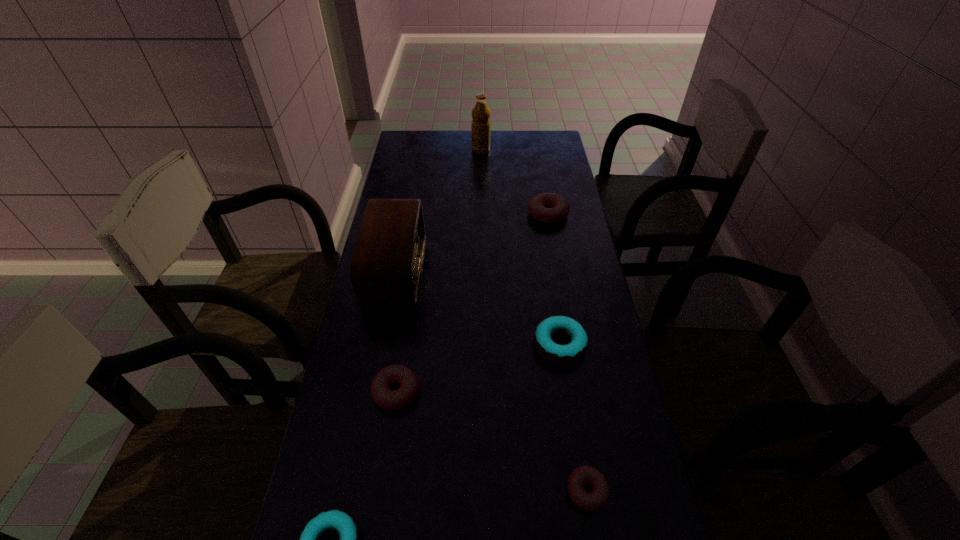
What are the coordinates of `the shortest object` in the screenshot? It's located at point(582,475).

You are a GUI agent. You are given a task and a screenshot of the screen. Output one action in this format:
    pyautogui.click(x=<x>, y=<y>)
    Task: Click on the nearest pink doughnut
    The height and width of the screenshot is (540, 960).
    Given the screenshot: What is the action you would take?
    [582, 475]

The image size is (960, 540). I want to click on free space located 0.280m on the front label of the farthest object, so click(x=408, y=150).

Image resolution: width=960 pixels, height=540 pixels. Identify the location of vacant space located 0.140m on the front label of the farthest object. (440, 150).

The image size is (960, 540). Identify the location of free space located 0.060m on the front label of the farthest object. (458, 150).

Where is `free space located 0.110m on the front panel of the fifth nearest object`? The image size is (960, 540). free space located 0.110m on the front panel of the fifth nearest object is located at coordinates (456, 272).

Where is `free spot located on the back of the farthest doughnut`? free spot located on the back of the farthest doughnut is located at coordinates (541, 178).

At what (x,y) coordinates should I click in order to perform the action: click on vacant region located on the back of the fourth nearest object. Please return your answer as a coordinate pair (x, y). Looking at the image, I should click on (547, 265).

You are a GUI agent. You are given a task and a screenshot of the screen. Output one action in this format:
    pyautogui.click(x=<x>, y=<y>)
    Task: Click on the vacant space located 0.150m on the back of the second farthest pink doughnut
    
    Given the screenshot: What is the action you would take?
    pyautogui.click(x=406, y=326)

Where is `free space located 0.310m on the left of the smallest pink doughnut`? The height and width of the screenshot is (540, 960). free space located 0.310m on the left of the smallest pink doughnut is located at coordinates (423, 491).